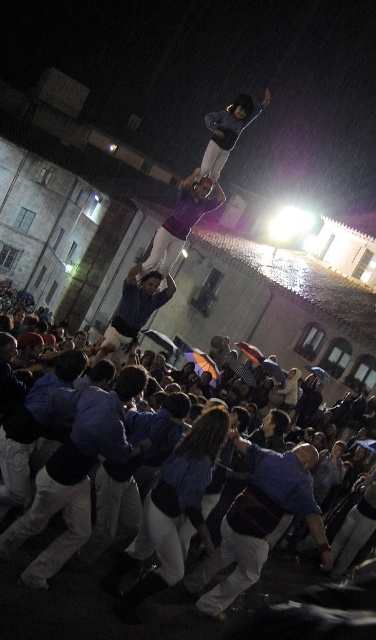
Question: Is blue cotton shirt at center to the left of purple fabric at center from the viewer's perspective?

Choices:
 (A) yes
 (B) no

Answer: (B)

Question: Which object is positioned closest to the purple fabric at center?

Choices:
 (A) blue cotton shirt at lower left
 (B) blue shirt at center

Answer: (B)

Question: Where is blue fabric shirt at center located in relation to matte black skateboard at upper center in the image?

Choices:
 (A) left
 (B) right

Answer: (A)

Question: Estimate the real-world distances between objects in this image. Which object is closer to the blue cotton shirt at lower left?

Choices:
 (A) purple fabric at center
 (B) matte black skateboard at upper center
 (C) blue shirt at center
 (D) blue cotton shirt at center

Answer: (D)

Question: Which point is closer to the camera taking this photo?

Choices:
 (A) (27, 520)
 (B) (165, 259)

Answer: (A)

Question: From the image, what is the correct spatial relationship of blue cotton shirt at center in relation to blue shirt at center?

Choices:
 (A) below
 (B) above

Answer: (A)